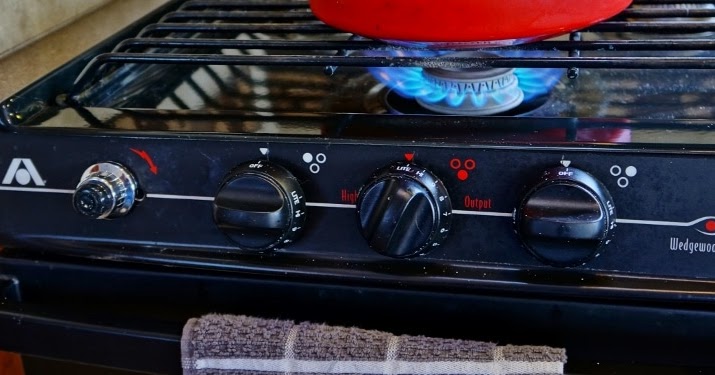
The image size is (715, 375). I want to click on oven handle, so click(x=79, y=343).